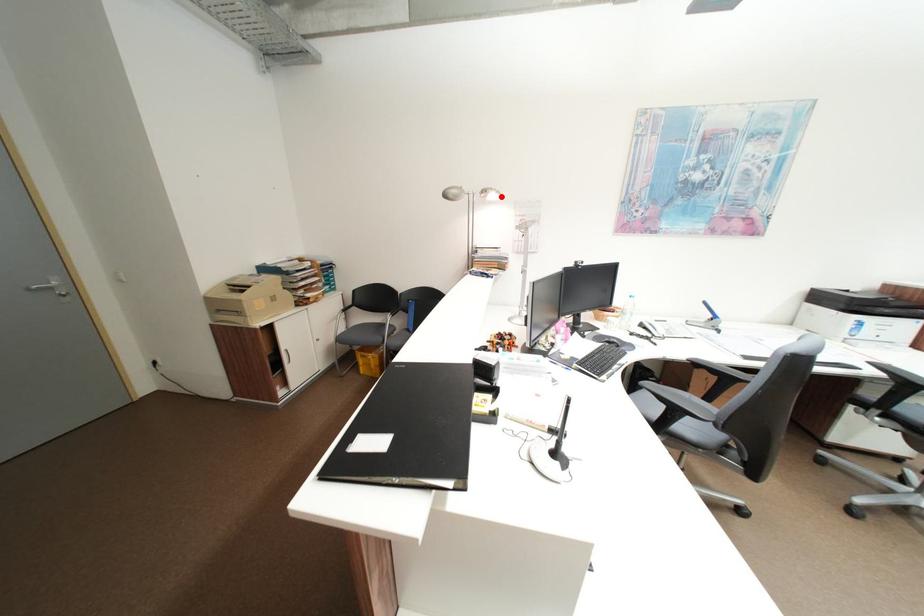
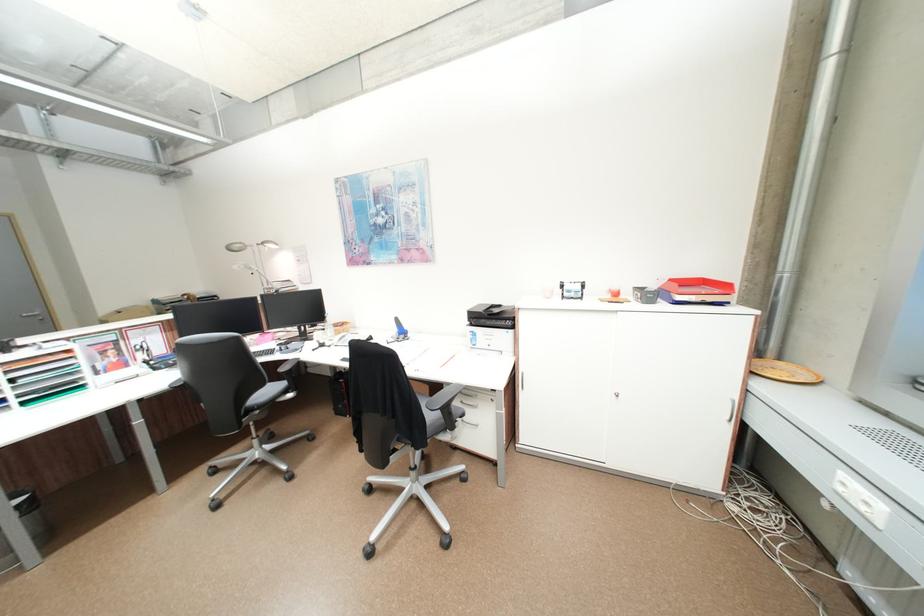
Question: I am providing you with two images of the same scene from different viewpoints. A red point is marked on the first image. At the location where the point appears in image 1, is it still visible in image 2?

Choices:
 (A) Yes
 (B) No

Answer: (A)